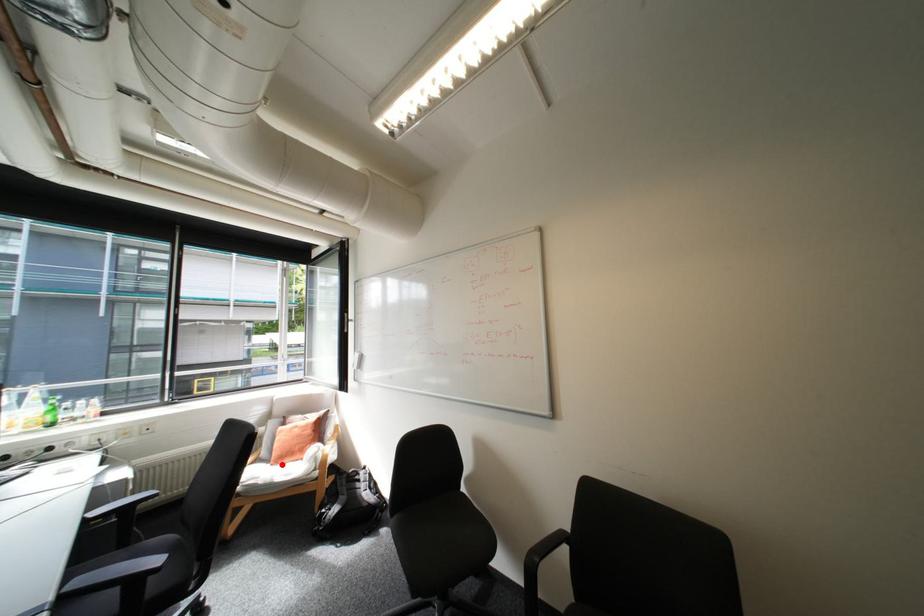
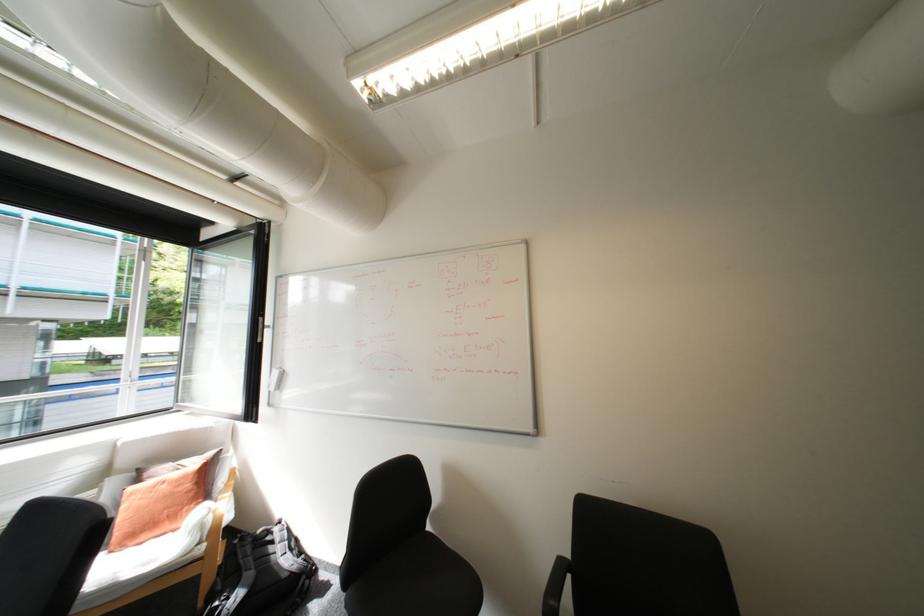
In the second image, find the point that corresponds to the highlighted location in the first image.

(122, 552)